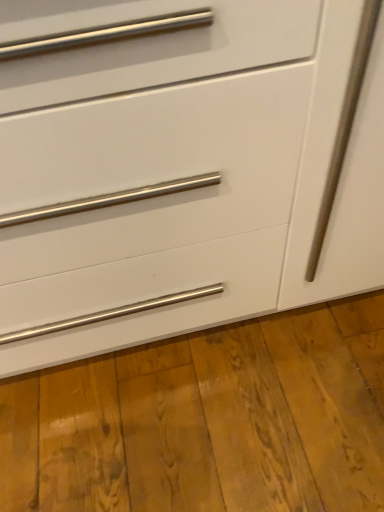
Measure the distance between point (231, 303) and camera.

34.80 inches.

Find the location of a particular element. The image size is (384, 512). white matte cabinet at center is located at coordinates (192, 182).

This screenshot has width=384, height=512. Describe the element at coordinates (192, 182) in the screenshot. I see `white matte cabinet at center` at that location.

What is the approximate height of white matte cabinet at center?

white matte cabinet at center is 33.50 inches tall.

Identify the location of white matte cabinet at center. (192, 182).